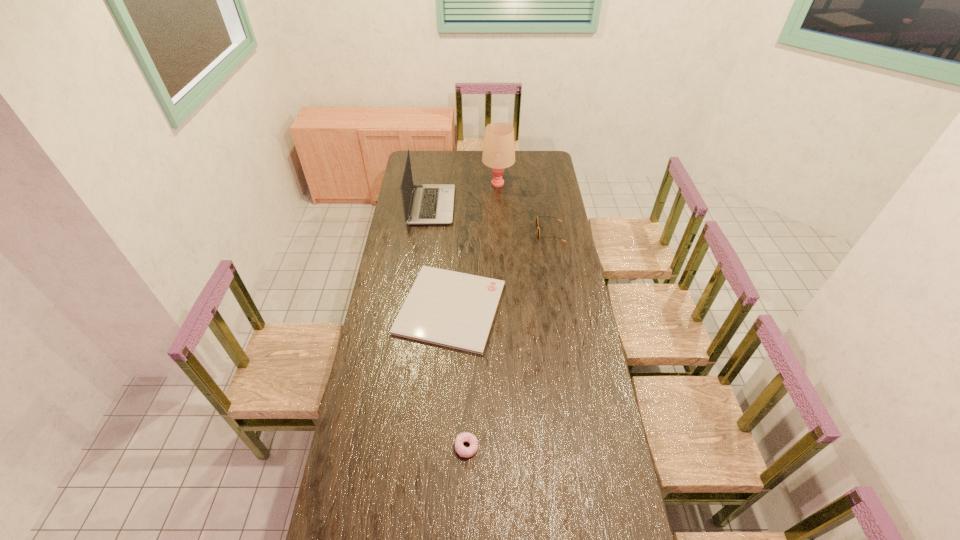
At what (x,y) coordinates should I click in order to perform the action: click on lampshade. Please return your answer as a coordinate pair (x, y). Looking at the image, I should click on (499, 149).

Where is `laptop computer`? The image size is (960, 540). laptop computer is located at coordinates (430, 204).

You are a GUI agent. You are given a task and a screenshot of the screen. Output one action in this format:
    pyautogui.click(x=<x>, y=<y>)
    Task: Click on the third tallest object
    
    Given the screenshot: What is the action you would take?
    pyautogui.click(x=537, y=216)

Locate an element on the screen. This screenshot has height=540, width=960. sunglasses is located at coordinates (537, 216).

Locate an element on the screen. This screenshot has width=960, height=540. the nearest object is located at coordinates (463, 437).

You are a GUI agent. You are given a task and a screenshot of the screen. Output one action in this format:
    pyautogui.click(x=<x>, y=<y>)
    Task: Click on the doughnut
    
    Given the screenshot: What is the action you would take?
    pyautogui.click(x=463, y=437)

Image resolution: width=960 pixels, height=540 pixels. I want to click on the fourth farthest object, so click(x=452, y=309).

Locate an element on the screen. The width and height of the screenshot is (960, 540). clipboard is located at coordinates (452, 309).

Locate an element on the screen. The height and width of the screenshot is (540, 960). free space located on the front of the lampshade is located at coordinates (500, 224).

In order to click on free space located on the screen of the laptop computer in this screenshot , I will do `click(479, 206)`.